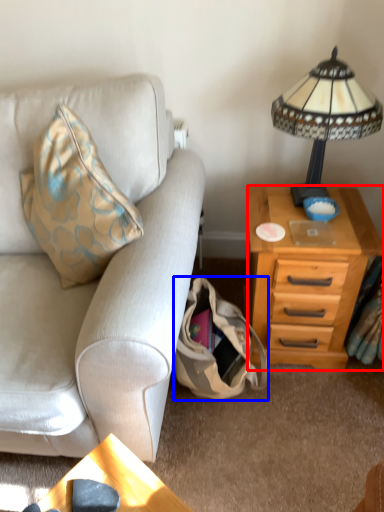
Question: Which object appears closest to the camera in this image, nightstand (highlighted by a red box) or handbag (highlighted by a blue box)?

Choices:
 (A) nightstand
 (B) handbag

Answer: (B)